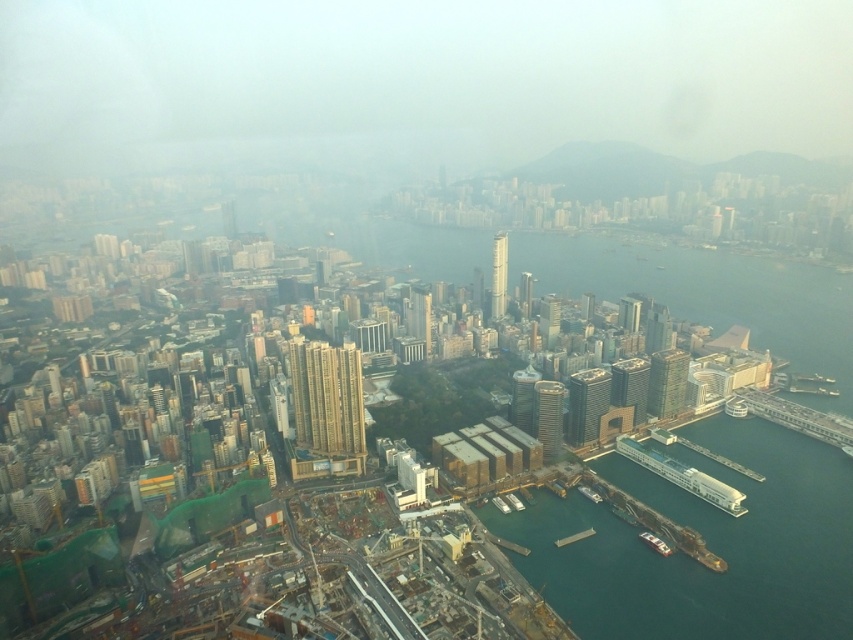
Can you confirm if white fog at center is wider than metallic gray boat at lower right?

Yes.

Between white fog at center and metallic gray boat at lower right, which one appears on the right side from the viewer's perspective?

Positioned to the right is metallic gray boat at lower right.

Who is more forward, (728, 1) or (650, 541)?

Point (650, 541)

Image resolution: width=853 pixels, height=640 pixels. I want to click on white fog at center, so click(415, 81).

The image size is (853, 640). Describe the element at coordinates (654, 541) in the screenshot. I see `metallic gray boat at lower right` at that location.

Does metallic gray boat at lower right appear under white plastic dock at lower right?

No, metallic gray boat at lower right is not below white plastic dock at lower right.

The image size is (853, 640). Describe the element at coordinates (654, 541) in the screenshot. I see `metallic gray boat at lower right` at that location.

Locate an element on the screen. The height and width of the screenshot is (640, 853). metallic gray boat at lower right is located at coordinates (654, 541).

Is white fog at center smaller than white plastic dock at lower right?

No, white fog at center is not smaller than white plastic dock at lower right.

Is white fog at center above white plastic dock at lower right?

Indeed, white fog at center is positioned over white plastic dock at lower right.

Locate an element on the screen. This screenshot has height=640, width=853. white fog at center is located at coordinates tap(415, 81).

This screenshot has height=640, width=853. I want to click on white fog at center, so click(x=415, y=81).